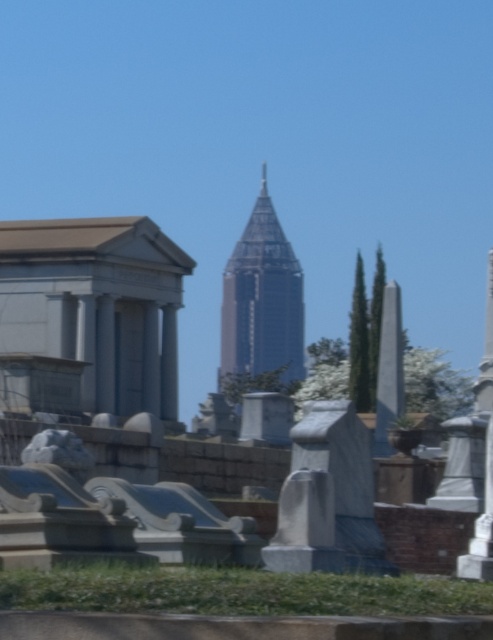
Question: In this image, where is shiny glass skyscraper at center located relative to white marble obelisk at right?

Choices:
 (A) below
 (B) above

Answer: (B)

Question: Which object appears farthest from the camera in this image?

Choices:
 (A) shiny glass skyscraper at center
 (B) white marble obelisk at right

Answer: (A)

Question: Among these objects, which one is farthest from the camera?

Choices:
 (A) white marble obelisk at right
 (B) shiny glass skyscraper at center

Answer: (B)

Question: Does shiny glass skyscraper at center have a lesser width compared to white marble obelisk at right?

Choices:
 (A) no
 (B) yes

Answer: (A)

Question: Is shiny glass skyscraper at center to the right of white marble obelisk at right from the viewer's perspective?

Choices:
 (A) yes
 (B) no

Answer: (B)